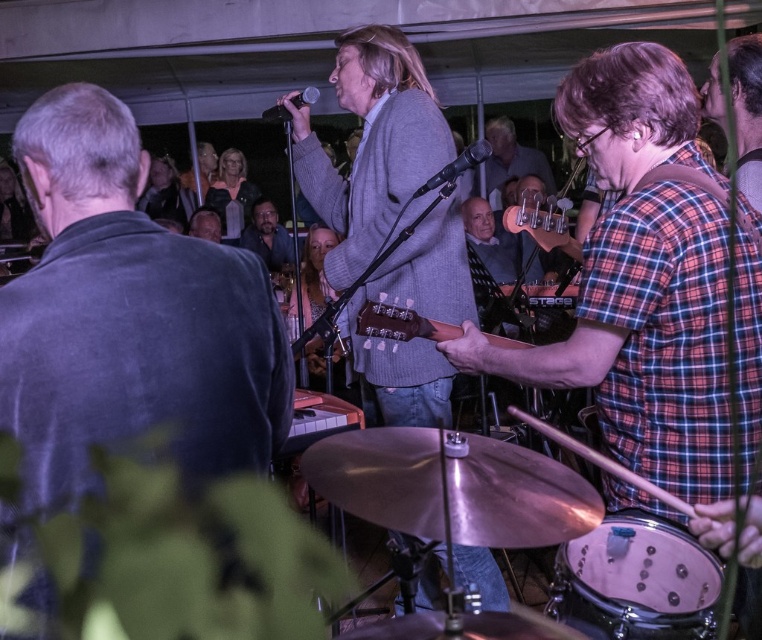
Question: Is white drumhead at lower right bigger than matte black guitar at center?

Choices:
 (A) no
 (B) yes

Answer: (A)

Question: Among these points, which one is nearest to the camera?

Choices:
 (A) (53, 436)
 (B) (266, 205)
 (C) (450, 168)

Answer: (A)

Question: Which object appears closest to the camera in this image?

Choices:
 (A) light brown wooden guitar at center
 (B) black matte microphone at center
 (C) matte black guitar at center
 (D) velvet blue jacket at upper left

Answer: (D)

Question: From the image, what is the correct spatial relationship of white drumhead at lower right in relation to black matte microphone at center?

Choices:
 (A) right
 (B) left

Answer: (A)

Question: Observing the image, what is the correct spatial positioning of light brown wooden guitar at center in reference to matte black guitar at center?

Choices:
 (A) above
 (B) below

Answer: (B)

Question: Which object appears closest to the camera in this image?

Choices:
 (A) matte black guitar at center
 (B) white drumhead at lower right

Answer: (B)